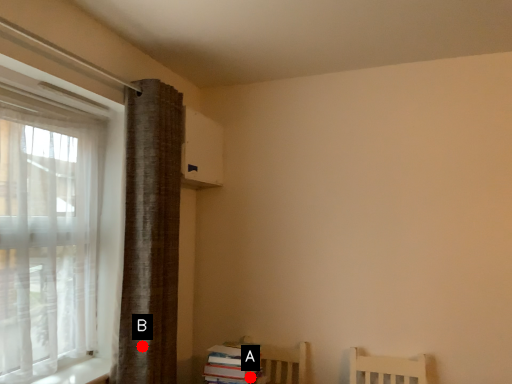
Question: Two points are circled on the image, labeled by A and B beside each circle. Which point appears closest to the camera in this image?

Choices:
 (A) A is closer
 (B) B is closer

Answer: (B)